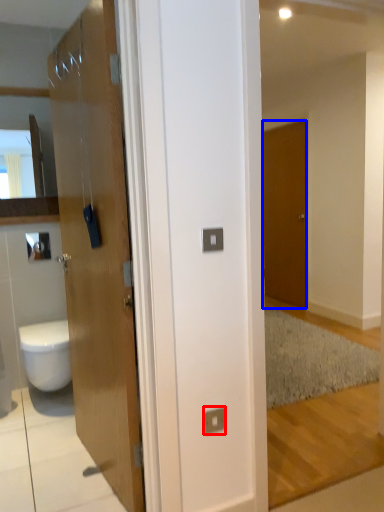
Question: Which object is further to the camera taking this photo, electric outlet (highlighted by a red box) or door (highlighted by a blue box)?

Choices:
 (A) electric outlet
 (B) door

Answer: (B)